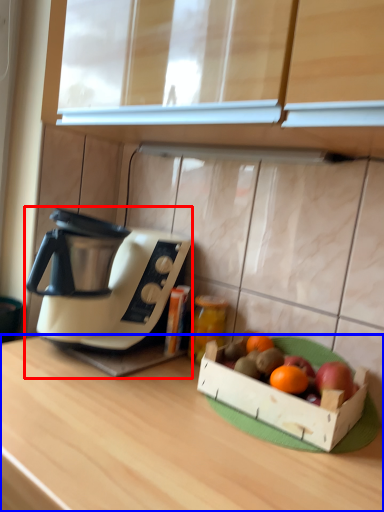
Question: Which object appears closest to the camera in this image, coffee maker (highlighted by a red box) or desk (highlighted by a blue box)?

Choices:
 (A) coffee maker
 (B) desk

Answer: (B)